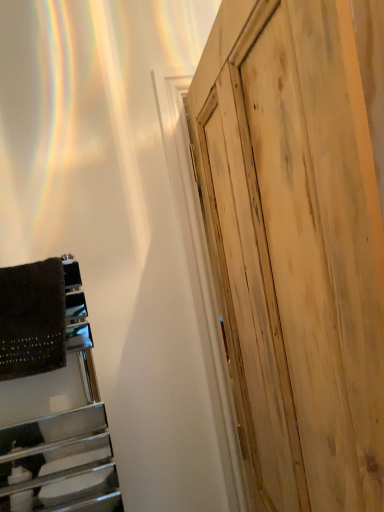
Question: From a real-world perspective, is dark brown textured blanket at left above or below natural wood door at right?

Choices:
 (A) above
 (B) below

Answer: (A)

Question: Based on their positions, is dark brown textured blanket at left located to the left or right of natural wood door at right?

Choices:
 (A) left
 (B) right

Answer: (A)

Question: Looking at the image, does dark brown textured blanket at left seem bigger or smaller compared to natural wood door at right?

Choices:
 (A) small
 (B) big

Answer: (A)

Question: Is point (365, 294) positioned closer to the camera than point (13, 271)?

Choices:
 (A) closer
 (B) farther

Answer: (A)

Question: Is natural wood door at right wider or thinner than dark brown textured blanket at left?

Choices:
 (A) wide
 (B) thin

Answer: (A)

Question: Is natural wood door at right inside or outside of dark brown textured blanket at left?

Choices:
 (A) inside
 (B) outside

Answer: (B)

Question: From the image's perspective, relative to dark brown textured blanket at left, is natural wood door at right above or below?

Choices:
 (A) below
 (B) above

Answer: (A)